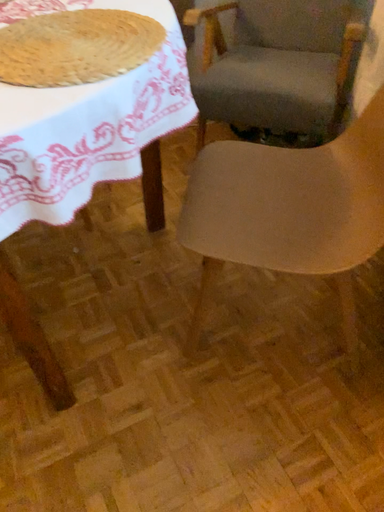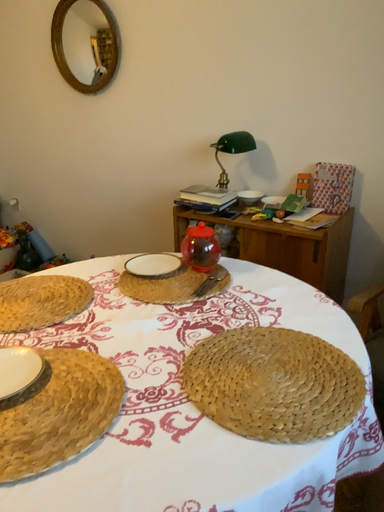
Question: Which way did the camera rotate in the video?

Choices:
 (A) rotated upward
 (B) rotated downward

Answer: (A)